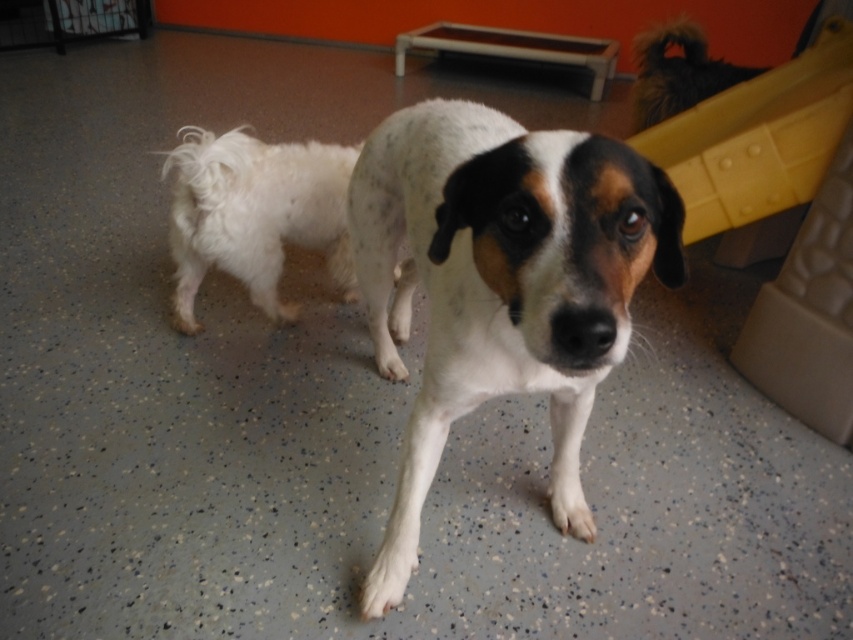
Question: Which object is closer to the camera taking this photo?

Choices:
 (A) white fluffy dog at left
 (B) fuzzy brown dog at upper right

Answer: (A)

Question: Which object appears closest to the camera in this image?

Choices:
 (A) fuzzy brown dog at upper right
 (B) yellow plastic slide at upper right
 (C) white speckled fur dog at center

Answer: (C)

Question: Does white fluffy dog at left have a larger size compared to fuzzy brown dog at upper right?

Choices:
 (A) no
 (B) yes

Answer: (B)

Question: Estimate the real-world distances between objects in this image. Which object is farther from the yellow plastic slide at upper right?

Choices:
 (A) fuzzy brown dog at upper right
 (B) white speckled fur dog at center

Answer: (B)

Question: From the image, what is the correct spatial relationship of white speckled fur dog at center in relation to yellow plastic slide at upper right?

Choices:
 (A) below
 (B) above

Answer: (A)

Question: Is white fluffy dog at left above yellow plastic slide at upper right?

Choices:
 (A) no
 (B) yes

Answer: (A)